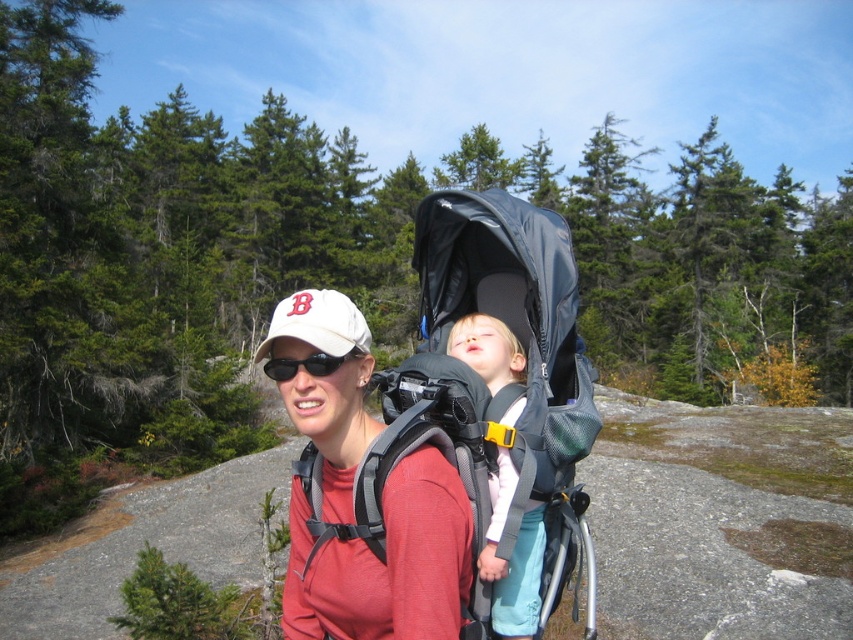
Looking at this image, you are a hiker who wants to ensure the sleeping bag is visible to others in case of an emergency. Since the black matte sunglasses at center are blocking the view, where should you move the light pink fabric sleeping bag at center?

The black matte sunglasses at center is behind the light pink fabric sleeping bag at center, so moving the light pink fabric sleeping bag at center to a position in front of the sunglasses would ensure it is visible.

You are a hiker who just arrived at this forest area. You notice the matte red shirt at center and the white matte baseball cap at center. Which one is positioned lower from the ground?

The matte red shirt at center is located below the white matte baseball cap at center, so the matte red shirt at center is positioned lower from the ground.